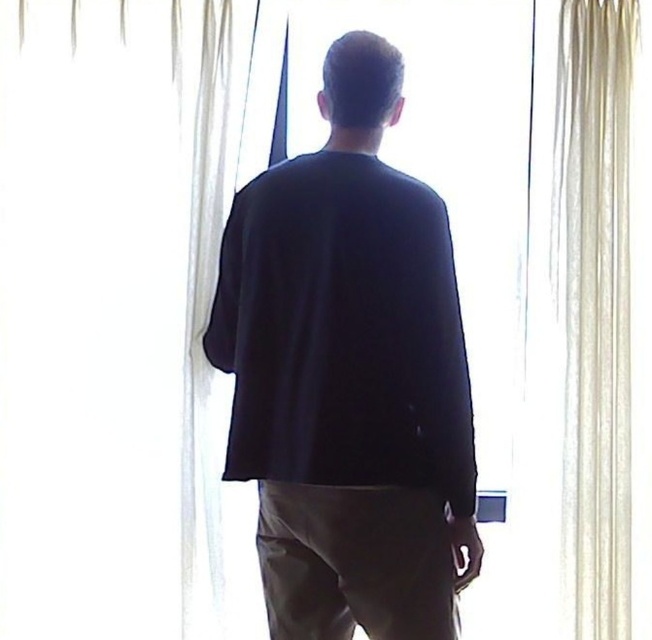
Question: Considering the relative positions of white sheer curtain at center and black matte shirt at center in the image provided, where is white sheer curtain at center located with respect to black matte shirt at center?

Choices:
 (A) left
 (B) right

Answer: (A)

Question: Based on their relative distances, which object is nearer to the black matte shirt at center?

Choices:
 (A) sheer white curtain at right
 (B) white sheer curtain at center

Answer: (B)

Question: Considering the real-world distances, which object is farthest from the black matte shirt at center?

Choices:
 (A) sheer white curtain at right
 (B) white sheer curtain at center

Answer: (A)

Question: Does black matte shirt at center come in front of sheer white curtain at right?

Choices:
 (A) no
 (B) yes

Answer: (B)

Question: Is white sheer curtain at center in front of black matte shirt at center?

Choices:
 (A) no
 (B) yes

Answer: (A)

Question: Which of the following is the farthest from the observer?

Choices:
 (A) (284, 324)
 (B) (168, 378)

Answer: (B)